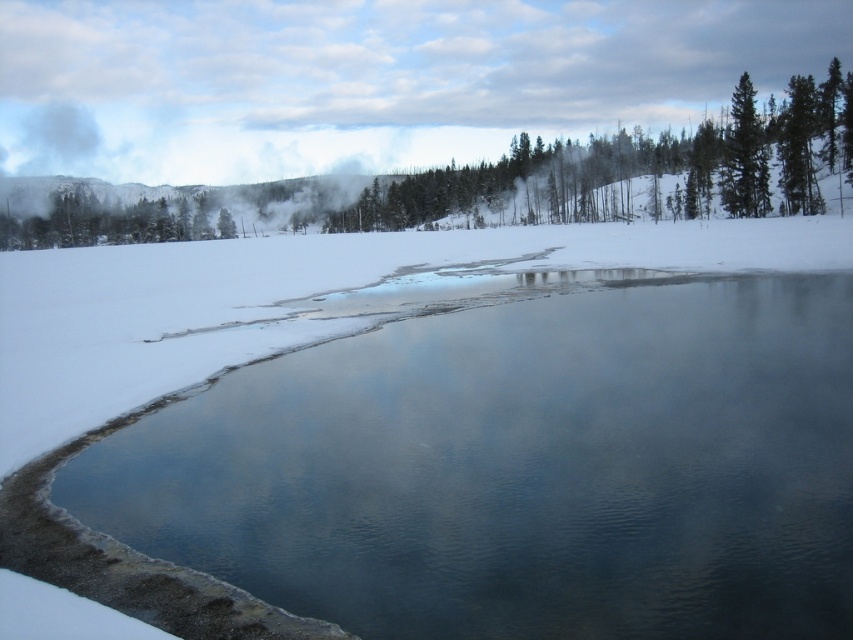
Question: Which point is farther to the camera?

Choices:
 (A) (809, 180)
 (B) (141, 237)
 (C) (732, 168)
 (D) (520, 502)

Answer: (B)

Question: Which point is farther to the camera?

Choices:
 (A) clear water at center
 (B) green matte tree at upper right
 (C) green textured tree at upper center

Answer: (B)

Question: Does green textured tree at upper center appear over green matte tree at upper right?

Choices:
 (A) yes
 (B) no

Answer: (A)

Question: Is green textured tree at upper center below green matte tree at upper right?

Choices:
 (A) no
 (B) yes

Answer: (A)

Question: Among these points, which one is farthest from the camera?

Choices:
 (A) (730, 204)
 (B) (132, 234)
 (C) (520, 486)
 (D) (830, 108)

Answer: (B)

Question: In this image, where is green textured tree at upper center located relative to green matte tree at upper right?

Choices:
 (A) left
 (B) right

Answer: (A)